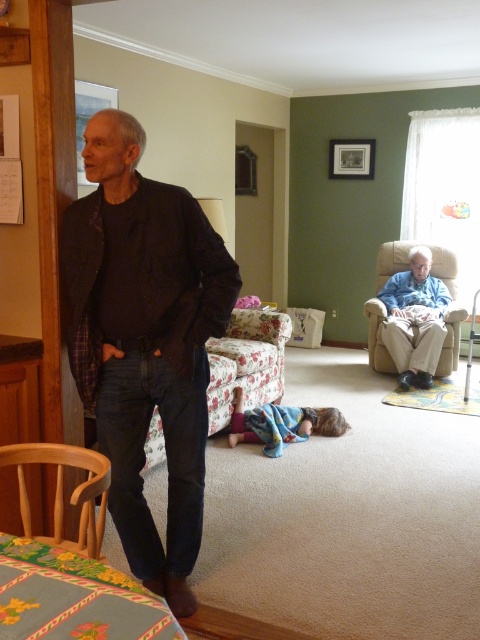
Question: Is wooden armchair at lower left above beige fabric armchair at center right?

Choices:
 (A) no
 (B) yes

Answer: (A)

Question: Which object appears farthest from the camera in this image?

Choices:
 (A) wooden armchair at lower left
 (B) beige fabric armchair at center right
 (C) dark blue jeans at left

Answer: (B)

Question: Can you confirm if dark blue jeans at left is positioned to the left of beige fabric armchair at center right?

Choices:
 (A) no
 (B) yes

Answer: (B)

Question: Can you confirm if dark blue jeans at left is positioned to the right of beige fabric armchair at center right?

Choices:
 (A) no
 (B) yes

Answer: (A)

Question: Which point is farther to the camera?

Choices:
 (A) beige fabric armchair at center right
 (B) dark blue jeans at left
 (C) wooden armchair at lower left

Answer: (A)

Question: Which of the following is the closest to the observer?

Choices:
 (A) (58, 492)
 (B) (448, 289)
 (C) (173, 515)

Answer: (A)